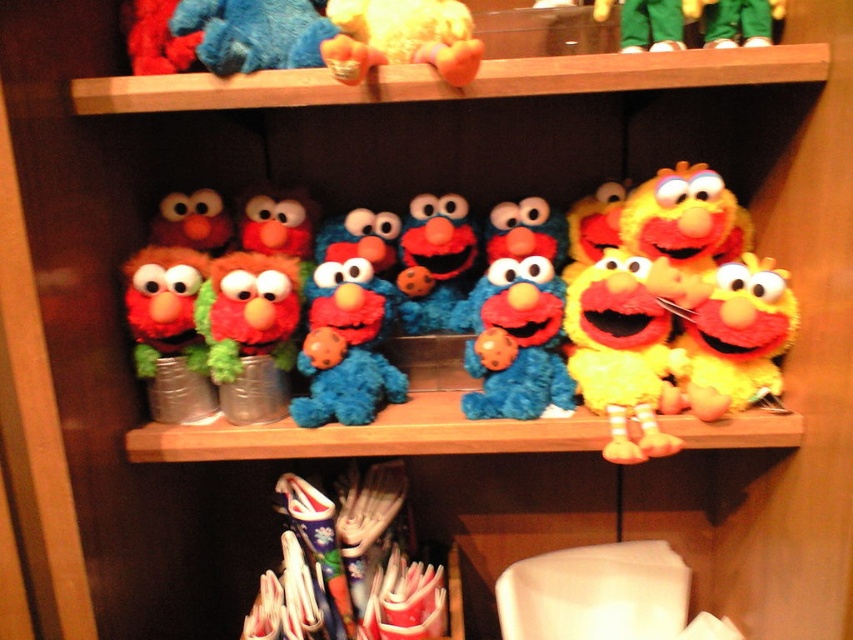
Locate an element on the screen. This screenshot has width=853, height=640. fluffy blue elmo at center is located at coordinates (576, 380).

Can you confirm if fluffy blue elmo at center is positioned to the left of yellow plush toy at right?

Indeed, fluffy blue elmo at center is positioned on the left side of yellow plush toy at right.

What do you see at coordinates (576, 380) in the screenshot? I see `fluffy blue elmo at center` at bounding box center [576, 380].

Where is `fluffy blue elmo at center`? This screenshot has height=640, width=853. fluffy blue elmo at center is located at coordinates (576, 380).

Who is taller, yellow plush toy at right or blue plush toy at upper center?

Standing taller between the two is yellow plush toy at right.

Is point (770, 268) closer to camera compared to point (183, 28)?

No, (770, 268) is further to viewer.

Is point (733, 346) closer to camera compared to point (204, 35)?

That is False.

Find the location of `yellow plush toy at right`. yellow plush toy at right is located at coordinates (735, 337).

What are the coordinates of `fuzzy green elmo at left` in the screenshot? It's located at point(167,332).

Does fuzzy green elmo at left appear under yellow plush toy at upper center?

Correct, fuzzy green elmo at left is located below yellow plush toy at upper center.

Who is more forward, (132, 259) or (383, 56)?

Point (383, 56) is in front.

Find the location of a particular element. This screenshot has height=640, width=853. fuzzy green elmo at left is located at coordinates (167, 332).